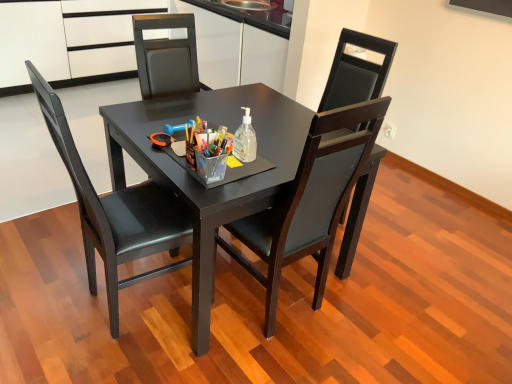
Question: Is white matte cabinet at upper left at the right side of matte black chair at center, placed as the 1th chair when sorted from right to left?

Choices:
 (A) no
 (B) yes

Answer: (A)

Question: Could matte black chair at center, placed as the 1th chair when sorted from right to left, be considered to be inside white matte cabinet at upper left?

Choices:
 (A) no
 (B) yes

Answer: (A)

Question: Is white matte cabinet at upper left shorter than matte black chair at center, which is the 2th chair from left to right?

Choices:
 (A) no
 (B) yes

Answer: (B)

Question: Is white matte cabinet at upper left at the left side of matte black chair at center, placed as the 1th chair when sorted from right to left?

Choices:
 (A) no
 (B) yes

Answer: (B)

Question: Is white matte cabinet at upper left oriented towards matte black chair at center, placed as the 1th chair when sorted from right to left?

Choices:
 (A) yes
 (B) no

Answer: (A)

Question: Is clear plastic bottle at center inside the boundaries of matte black chair at center, placed as the 1th chair when sorted from right to left, or outside?

Choices:
 (A) inside
 (B) outside

Answer: (A)

Question: Considering the positions of clear plastic bottle at center and matte black chair at center, which is the 2th chair from left to right, in the image, is clear plastic bottle at center bigger or smaller than matte black chair at center, which is the 2th chair from left to right,?

Choices:
 (A) small
 (B) big

Answer: (A)

Question: From a real-world perspective, is clear plastic bottle at center positioned above or below matte black chair at center, which is the 2th chair from left to right?

Choices:
 (A) above
 (B) below

Answer: (A)

Question: Is clear plastic bottle at center to the left or to the right of matte black chair at center, which is the 2th chair from left to right, in the image?

Choices:
 (A) right
 (B) left

Answer: (B)

Question: In the image, is matte black table at center on the left side or the right side of clear plastic bottle at center?

Choices:
 (A) right
 (B) left

Answer: (B)

Question: Considering the positions of matte black table at center and clear plastic bottle at center in the image, is matte black table at center taller or shorter than clear plastic bottle at center?

Choices:
 (A) short
 (B) tall

Answer: (B)

Question: Based on their sizes in the image, would you say matte black table at center is bigger or smaller than clear plastic bottle at center?

Choices:
 (A) small
 (B) big

Answer: (B)

Question: Is matte black table at center spatially inside clear plastic bottle at center, or outside of it?

Choices:
 (A) outside
 (B) inside

Answer: (A)

Question: From a real-world perspective, is matte black table at center physically located above or below matte black chair at center, which ranks as the 1th chair in left-to-right order?

Choices:
 (A) below
 (B) above

Answer: (A)

Question: Is matte black table at center in front of or behind matte black chair at center, which ranks as the 1th chair in left-to-right order, in the image?

Choices:
 (A) front
 (B) behind

Answer: (B)